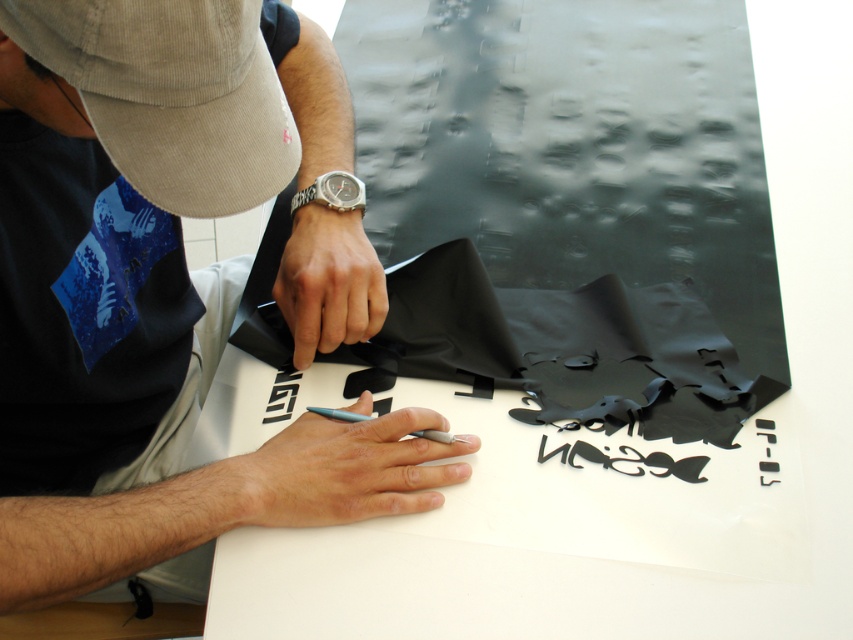
Question: Does silver metallic watch at center appear under black paper cutout at center?

Choices:
 (A) yes
 (B) no

Answer: (B)

Question: Is the position of matte black paper at center less distant than that of silver metallic watch at center?

Choices:
 (A) no
 (B) yes

Answer: (B)

Question: Which point is farther from the camera taking this photo?

Choices:
 (A) (321, 195)
 (B) (287, 417)
 (C) (387, 432)

Answer: (A)

Question: Which object appears closest to the camera in this image?

Choices:
 (A) black paper cutout at center
 (B) matte black paper at center
 (C) silver metallic watch at center

Answer: (B)

Question: Which point is closer to the camera taking this photo?

Choices:
 (A) (294, 376)
 (B) (340, 170)
 (C) (294, 269)

Answer: (C)

Question: Does matte black paper at center have a lesser width compared to silver metallic watch at center?

Choices:
 (A) no
 (B) yes

Answer: (A)